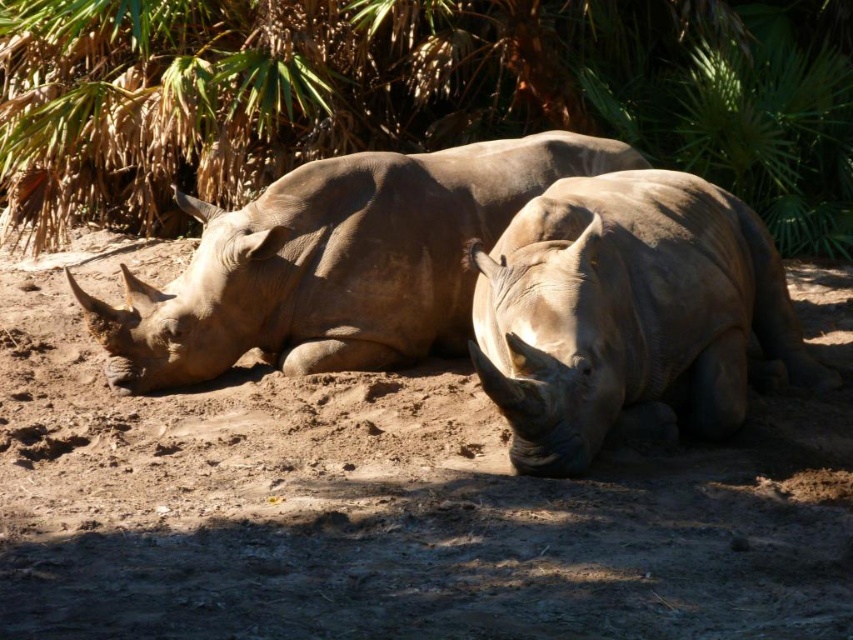
Image resolution: width=853 pixels, height=640 pixels. In order to click on brown sandy dirt at center in this screenshot , I will do `click(381, 502)`.

Is brown sandy dirt at center thinner than smooth gray rhino at center?

Yes, brown sandy dirt at center is thinner than smooth gray rhino at center.

Which is behind, point (77, 634) or point (370, 323)?

The point (370, 323) is behind.

Identify the location of brown sandy dirt at center. The image size is (853, 640). (x=381, y=502).

In the scene shown: Can you confirm if smooth gray rhino at center is positioned above gray matte rhino at center?

Indeed, smooth gray rhino at center is positioned over gray matte rhino at center.

Is point (409, 205) farther from camera compared to point (544, 228)?

Yes, it is.

Where is `smooth gray rhino at center`? Image resolution: width=853 pixels, height=640 pixels. smooth gray rhino at center is located at coordinates (335, 262).

Is green leafy tree at upper center above gray matte rhino at center?

Yes.

Which is in front, point (485, 61) or point (593, 250)?

Point (593, 250) is in front.

Which is in front, point (595, 3) or point (715, 381)?

Point (715, 381)

At what (x,y) coordinates should I click in order to perform the action: click on green leafy tree at upper center. Please return your answer as a coordinate pair (x, y). The image size is (853, 640). Looking at the image, I should click on (413, 97).